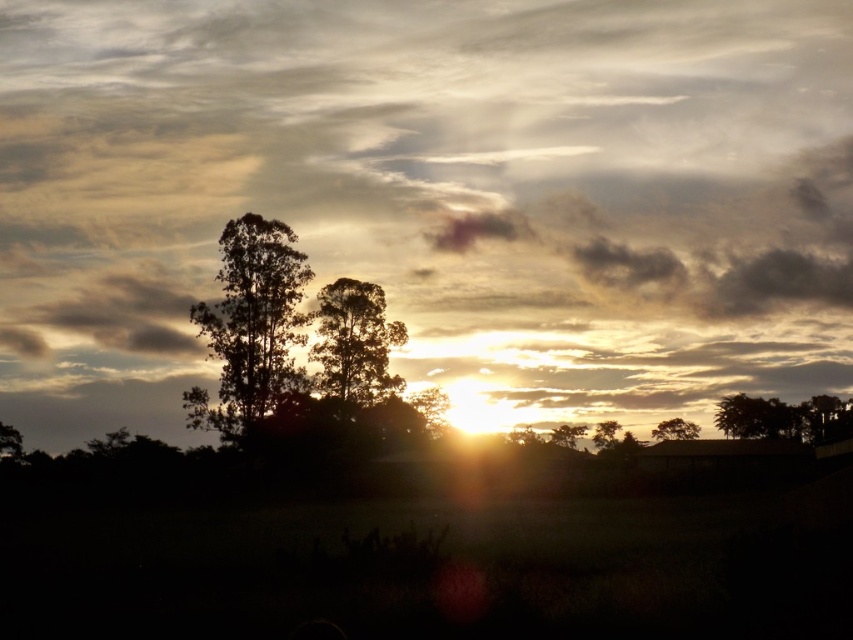
You are standing in the field looking towards the sunset. There are two points marked in the image. The first point is at coordinate point (x=370, y=380) and the second is at point (x=595, y=440). Which point is closer to you?

Point (x=370, y=380) is closer to the camera than point (x=595, y=440), so the first point is closer to you.

You are an artist painting the sunset scene. You want to ensure the silhouette leafy tree at left and silvery metallic tree at upper right are proportionally accurate. Which tree should you draw wider in your painting?

The silvery metallic tree at upper right should be drawn wider because its width is greater than the silhouette leafy tree at left.